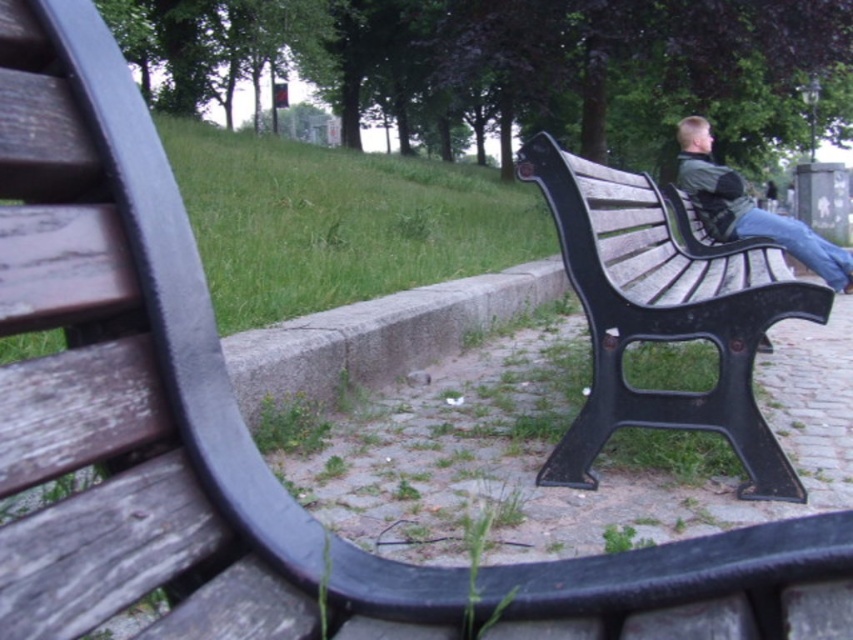
Question: Among these points, which one is farthest from the camera?

Choices:
 (A) (589, 412)
 (B) (798, 220)

Answer: (B)

Question: Where is wooden bench at right located in relation to greenish-gray fabric jacket at right in the image?

Choices:
 (A) right
 (B) left

Answer: (B)

Question: Is wooden bench at right smaller than greenish-gray fabric jacket at right?

Choices:
 (A) yes
 (B) no

Answer: (B)

Question: From the image, what is the correct spatial relationship of wooden bench at right in relation to greenish-gray fabric jacket at right?

Choices:
 (A) left
 (B) right

Answer: (A)

Question: Which point is farther to the camera?

Choices:
 (A) (711, 170)
 (B) (521, 157)

Answer: (A)